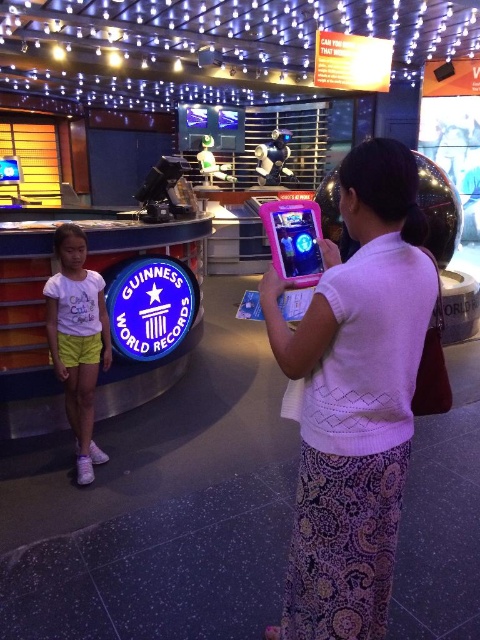
You are a visitor in the Guinness World Records exhibit and want to take a photo of the pink plastic tablet at center without the white matte shirt at left blocking the view. Is this possible given their positions?

Answer: The white matte shirt at left is further to the viewer than the pink plastic tablet at center, so it would block the view of the tablet. Therefore, you cannot take a photo of the pink plastic tablet at center without the white matte shirt at left obstructing it.

You are a visitor at the Guinness World Records exhibit and see two tablets at the center. Which one is closer to you, the pink fabric tablet at center or the pink plastic tablet at center?

The pink fabric tablet at center is closer to you because it is in front of the pink plastic tablet at center.